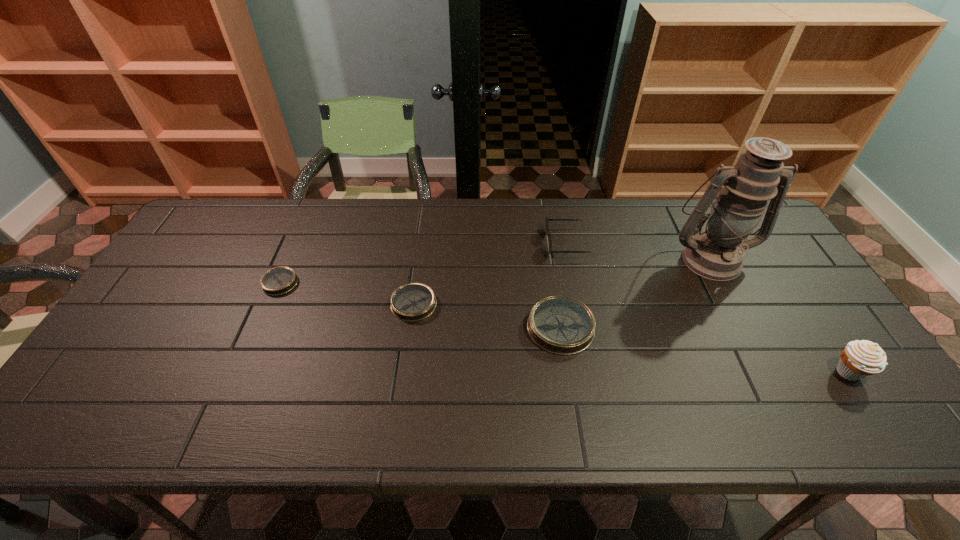
The image size is (960, 540). What are the coordinates of `vacant space that's between the fifth tallest object and the oil lamp` in the screenshot? It's located at (562, 281).

Find the location of `unoccupied position between the nearest object and the second object from right to left`. unoccupied position between the nearest object and the second object from right to left is located at coordinates (780, 315).

Locate an element on the screen. free space between the leftmost compass and the second compass from right to left is located at coordinates (347, 293).

Locate an element on the screen. The width and height of the screenshot is (960, 540). free space that is in between the oil lamp and the second tallest compass is located at coordinates (562, 281).

The height and width of the screenshot is (540, 960). I want to click on vacant space that's between the fifth tallest object and the second tallest object, so click(631, 338).

Where is `empty space between the sunglasses and the leftmost compass`? The height and width of the screenshot is (540, 960). empty space between the sunglasses and the leftmost compass is located at coordinates (423, 263).

This screenshot has height=540, width=960. I want to click on empty space between the nearest object and the oil lamp, so click(780, 315).

You are a GUI agent. You are given a task and a screenshot of the screen. Output one action in this format:
    pyautogui.click(x=<x>, y=<y>)
    Task: Click on the unoccupied position between the fourth tallest object and the second compass from left to right
    
    Given the screenshot: What is the action you would take?
    pyautogui.click(x=488, y=316)

I want to click on vacant space in between the second compass from right to left and the third tallest object, so click(x=490, y=273).

Select which object is the third closest to the shortest object. Please provide its 2D coordinates. Your answer should be formatted as a tuple, i.e. [(x, y)], where the tuple contains the x and y coordinates of a point satisfying the conditions above.

[(547, 219)]